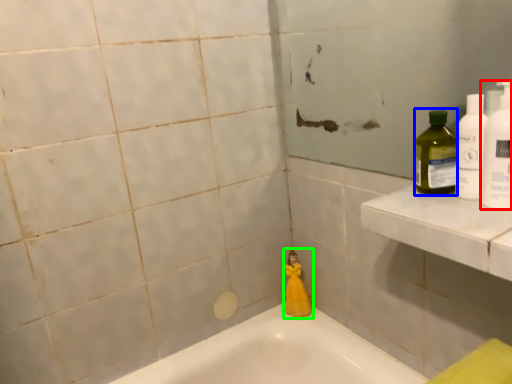
Question: Based on their relative distances, which object is farther from cleaning product (highlighted by a red box)? Choose from cleaning product (highlighted by a blue box) and toy (highlighted by a green box).

Choices:
 (A) cleaning product
 (B) toy

Answer: (B)